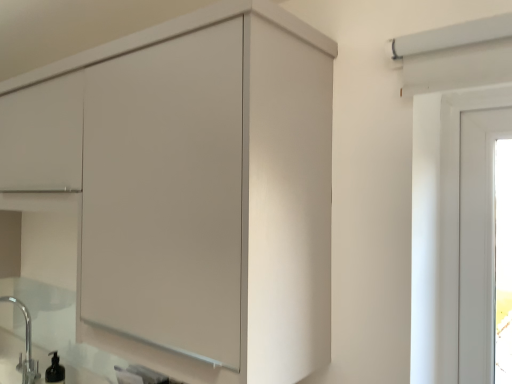
This screenshot has height=384, width=512. Describe the element at coordinates (25, 346) in the screenshot. I see `satin nickel faucet at lower left` at that location.

Measure the distance between satin nickel faucet at lower left and camera.

The depth of satin nickel faucet at lower left is 6.56 feet.

Find the location of a particular element. The width and height of the screenshot is (512, 384). satin nickel faucet at lower left is located at coordinates (25, 346).

This screenshot has height=384, width=512. Describe the element at coordinates (192, 187) in the screenshot. I see `matte white cupboard at center` at that location.

The width and height of the screenshot is (512, 384). I want to click on matte white cupboard at center, so click(192, 187).

Find the location of a particular element. The height and width of the screenshot is (384, 512). satin nickel faucet at lower left is located at coordinates (25, 346).

Which object is positioned more to the left, satin nickel faucet at lower left or matte white cupboard at center?

satin nickel faucet at lower left.

Is satin nickel faucet at lower left closer to camera compared to matte white cupboard at center?

No, satin nickel faucet at lower left is further to the viewer.

Which point is more forward, (19, 304) or (129, 245)?

The point (129, 245) is closer.

From the image's perspective, which is above, satin nickel faucet at lower left or matte white cupboard at center?

matte white cupboard at center.

From a real-world perspective, which is physically below, satin nickel faucet at lower left or matte white cupboard at center?

In real-world perspective, satin nickel faucet at lower left is lower.

Is satin nickel faucet at lower left wider than matte white cupboard at center?

No.

Is satin nickel faucet at lower left shorter than matte white cupboard at center?

Indeed, satin nickel faucet at lower left has a lesser height compared to matte white cupboard at center.

Considering the relative sizes of satin nickel faucet at lower left and matte white cupboard at center in the image provided, is satin nickel faucet at lower left smaller than matte white cupboard at center?

Yes, satin nickel faucet at lower left is smaller than matte white cupboard at center.

Which is correct: satin nickel faucet at lower left is inside matte white cupboard at center, or outside of it?

satin nickel faucet at lower left is outside matte white cupboard at center.

Is satin nickel faucet at lower left next to matte white cupboard at center?

satin nickel faucet at lower left and matte white cupboard at center are not in contact.

Is satin nickel faucet at lower left oriented away from matte white cupboard at center?

No.

The width and height of the screenshot is (512, 384). I want to click on faucet that is behind the matte white cupboard at center, so click(x=25, y=346).

Which object is positioned more to the left, matte white cupboard at center or satin nickel faucet at lower left?

satin nickel faucet at lower left is more to the left.

Between matte white cupboard at center and satin nickel faucet at lower left, which one is positioned in front?

matte white cupboard at center is in front.

Does point (193, 256) lie behind point (19, 306)?

No, (193, 256) is in front of (19, 306).

From the image's perspective, is matte white cupboard at center below satin nickel faucet at lower left?

No, from the image's perspective, matte white cupboard at center is not beneath satin nickel faucet at lower left.

From a real-world perspective, which is physically below, matte white cupboard at center or satin nickel faucet at lower left?

In real-world perspective, satin nickel faucet at lower left is lower.

Which object is wider, matte white cupboard at center or satin nickel faucet at lower left?

Wider between the two is matte white cupboard at center.

From their relative heights in the image, would you say matte white cupboard at center is taller or shorter than satin nickel faucet at lower left?

In the image, matte white cupboard at center appears to be taller than satin nickel faucet at lower left.

Does matte white cupboard at center have a smaller size compared to satin nickel faucet at lower left?

Incorrect, matte white cupboard at center is not smaller in size than satin nickel faucet at lower left.

Is satin nickel faucet at lower left surrounded by matte white cupboard at center?

A: No, satin nickel faucet at lower left is located outside of matte white cupboard at center.

Is matte white cupboard at center next to satin nickel faucet at lower left?

No, matte white cupboard at center is not making contact with satin nickel faucet at lower left.

Is matte white cupboard at center aimed at satin nickel faucet at lower left?

No, matte white cupboard at center does not turn towards satin nickel faucet at lower left.

Locate an element on the screen. This screenshot has width=512, height=384. cupboard in front of the satin nickel faucet at lower left is located at coordinates (192, 187).

The height and width of the screenshot is (384, 512). What are the coordinates of `cupboard in front of the satin nickel faucet at lower left` in the screenshot? It's located at (192, 187).

What are the coordinates of `cupboard lying above the satin nickel faucet at lower left (from the image's perspective)` in the screenshot? It's located at (192, 187).